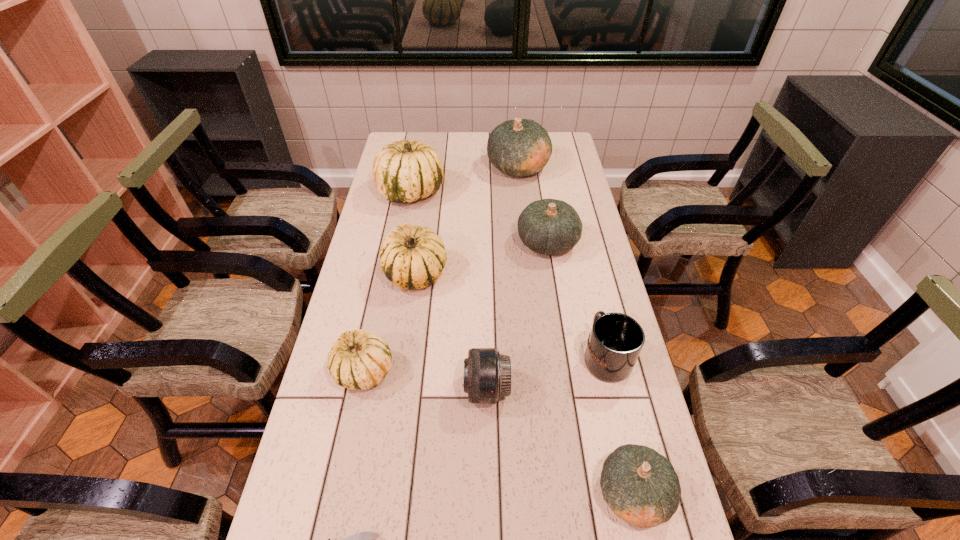
At what (x,y) coordinates should I click in order to perform the action: click on free space located on the back of the nearest gourd. Please return your answer as a coordinate pair (x, y). This screenshot has width=960, height=540. Looking at the image, I should click on (606, 369).

You are a GUI agent. You are given a task and a screenshot of the screen. Output one action in this format:
    pyautogui.click(x=<x>, y=<y>)
    Task: Click on the vacant space located on the front of the fifth farthest gourd
    Image resolution: width=960 pixels, height=540 pixels.
    Given the screenshot: What is the action you would take?
    pyautogui.click(x=349, y=441)

I want to click on object at the far edge, so click(521, 147).

Locate an element on the screen. This screenshot has height=540, width=960. mug located at the right edge is located at coordinates (615, 341).

Where is `object that is at the far right corner`? Image resolution: width=960 pixels, height=540 pixels. object that is at the far right corner is located at coordinates (521, 147).

Identify the location of free space at the far edge. (464, 144).

Locate an element on the screen. The height and width of the screenshot is (540, 960). vacant area at the left edge is located at coordinates (315, 411).

The image size is (960, 540). Identify the location of free location at the right edge of the desktop. (568, 340).

In the image, there is a desktop. Where is `vacant space at the far left corner`? vacant space at the far left corner is located at coordinates (414, 132).

What are the coordinates of `free spot between the black mug and the nearest orange gourd` in the screenshot? It's located at (619, 425).